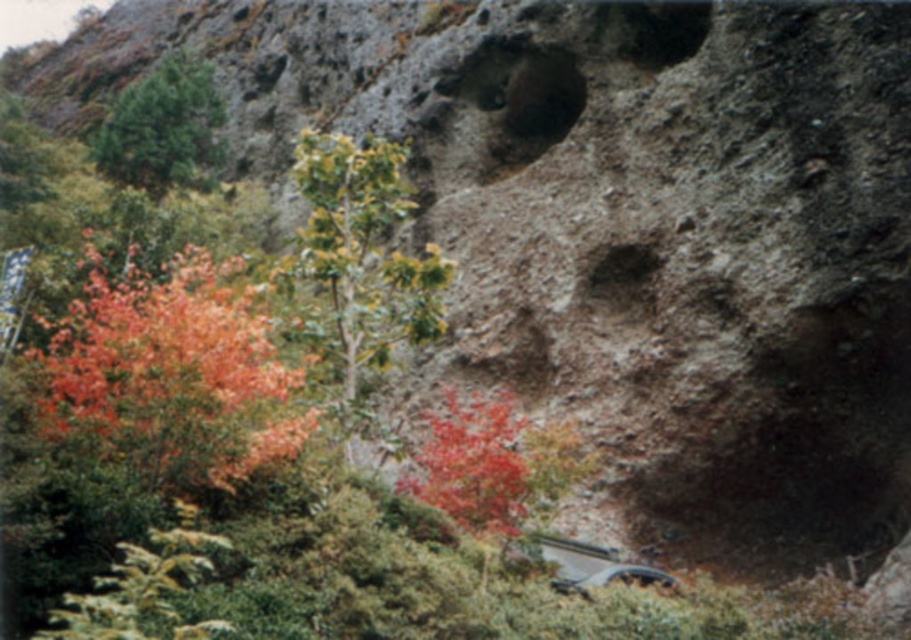
Question: Is green leafy tree at center behind vivid red leaves at center?

Choices:
 (A) no
 (B) yes

Answer: (B)

Question: Among these points, which one is farthest from the camera?

Choices:
 (A) (347, 358)
 (B) (630, 570)
 (C) (198, 72)
 (D) (500, 416)

Answer: (C)

Question: Is green matte tree at upper left positioned in front of metallic silver car at lower center?

Choices:
 (A) yes
 (B) no

Answer: (B)

Question: Considering the real-world distances, which object is farthest from the metallic silver car at lower center?

Choices:
 (A) vivid red leaves at center
 (B) vivid orange leaves at left
 (C) green matte tree at upper left
 (D) green leafy tree at center

Answer: (C)

Question: Which object is farther from the camera taking this photo?

Choices:
 (A) vivid red leaves at center
 (B) green leafy tree at center
 (C) green matte tree at upper left
 (D) metallic silver car at lower center

Answer: (C)

Question: In this image, where is green leafy tree at center located relative to metallic silver car at lower center?

Choices:
 (A) below
 (B) above

Answer: (B)